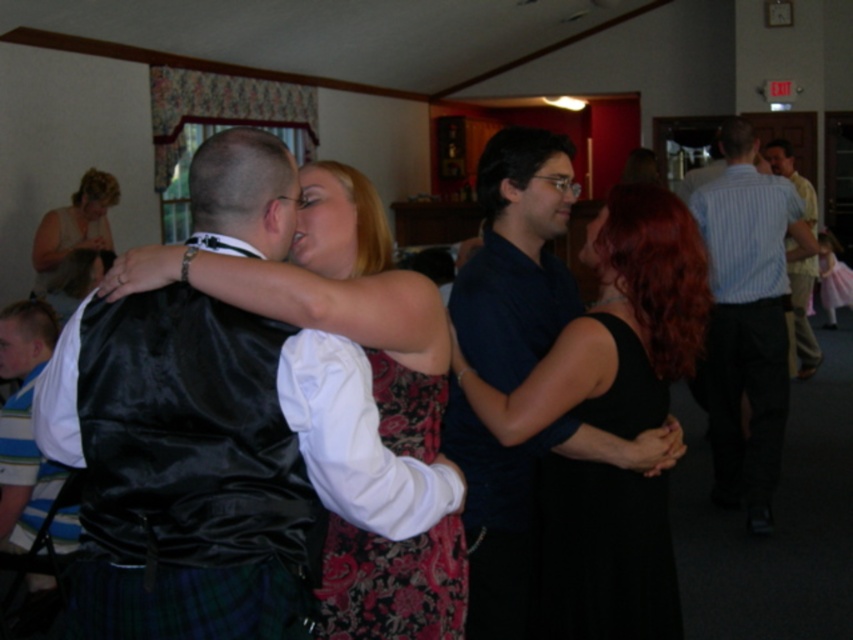
Question: Among these points, which one is farthest from the camera?

Choices:
 (A) (786, 413)
 (B) (77, 209)
 (C) (12, 454)

Answer: (B)

Question: Can you confirm if shiny black vest at center is positioned to the right of shiny black dress at center?

Choices:
 (A) yes
 (B) no

Answer: (B)

Question: From the image, what is the correct spatial relationship of light blue striped shirt at right in relation to white striped shirt at left?

Choices:
 (A) below
 (B) above

Answer: (B)

Question: From the image, what is the correct spatial relationship of light blue striped shirt at right in relation to matte black dress at upper left?

Choices:
 (A) above
 (B) below

Answer: (B)

Question: Which of these objects is positioned closest to the black satin dress at center?

Choices:
 (A) white striped shirt at left
 (B) light blue striped shirt at right
 (C) striped shirt at right
 (D) shiny black vest at center

Answer: (D)

Question: Which point appears farthest from the camera in this image?

Choices:
 (A) (457, 605)
 (B) (1, 529)
 (C) (608, 252)

Answer: (B)